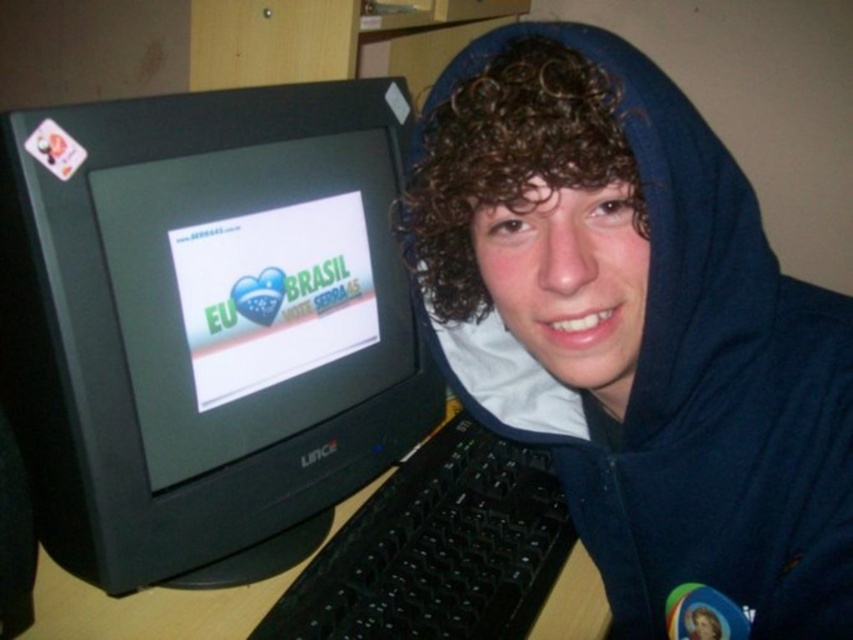
Question: Estimate the real-world distances between objects in this image. Which object is closer to the wooden at left?

Choices:
 (A) black plastic monitor at left
 (B) blue fleece hoodie at center

Answer: (A)

Question: Is black plastic monitor at left above wooden at left?

Choices:
 (A) no
 (B) yes

Answer: (B)

Question: Which object is farther from the camera taking this photo?

Choices:
 (A) black plastic monitor at left
 (B) wooden at left
 (C) blue fleece hoodie at center

Answer: (B)

Question: Can you confirm if black plastic monitor at left is bigger than blue fleece hoodie at center?

Choices:
 (A) yes
 (B) no

Answer: (A)

Question: In this image, where is black plastic monitor at left located relative to wooden at left?

Choices:
 (A) below
 (B) above

Answer: (B)

Question: Which object is closer to the camera taking this photo?

Choices:
 (A) wooden at left
 (B) blue fleece hoodie at center

Answer: (B)